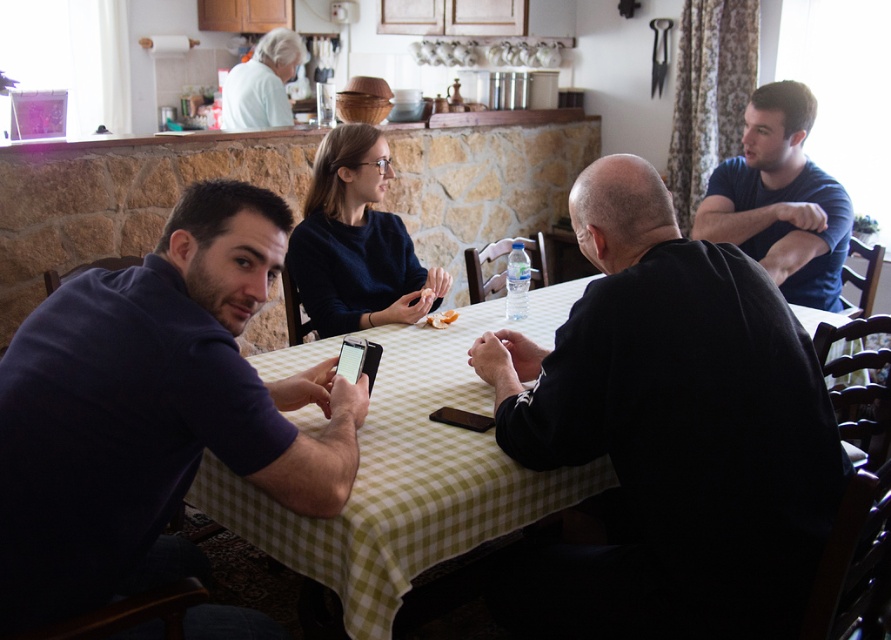
You are a delivery person who needs to place a small package between the black matte shirt at center and the dark blue cotton shirt at left. The package is 60 centimeters long. Will it fit between them?

The black matte shirt at center is 63.74 centimeters from the dark blue cotton shirt at left. Since the package is 60 centimeters long, it will fit between them as the distance is sufficient.